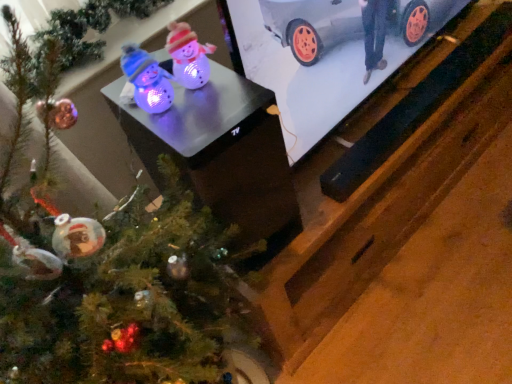
The image size is (512, 384). What are the coordinates of `green matte christmas tree at lower left` in the screenshot? It's located at (105, 272).

From the image's perspective, is matte plastic table at center on metallic silver car at upper right?

Actually, matte plastic table at center appears below metallic silver car at upper right in the image.

Is there a large distance between matte plastic table at center and metallic silver car at upper right?

matte plastic table at center is near metallic silver car at upper right, not far away.

Considering the relative sizes of matte plastic table at center and metallic silver car at upper right in the image provided, is matte plastic table at center taller than metallic silver car at upper right?

No.

From a real-world perspective, relative to metallic silver car at upper right, is matte plastic table at center vertically above or below?

matte plastic table at center is below metallic silver car at upper right.

From a real-world perspective, is green matte christmas tree at lower left above or below matte plastic table at center?

In terms of real-world spatial position, green matte christmas tree at lower left is below matte plastic table at center.

Is green matte christmas tree at lower left far from matte plastic table at center?

No, green matte christmas tree at lower left is not far from matte plastic table at center.

From the image's perspective, would you say green matte christmas tree at lower left is positioned over matte plastic table at center?

No.

Which is less distant, (211, 195) or (49, 57)?

Point (211, 195).

From the picture: Measure the distance between matte plastic table at center and green matte christmas tree at lower left.

A distance of 5.96 inches exists between matte plastic table at center and green matte christmas tree at lower left.

At what (x,y) coordinates should I click in order to perform the action: click on christmas tree below the matte plastic table at center (from the image's perspective). Please return your answer as a coordinate pair (x, y). This screenshot has height=384, width=512. Looking at the image, I should click on (105, 272).

Is matte plastic table at center outside of green matte christmas tree at lower left?

matte plastic table at center is positioned outside green matte christmas tree at lower left.

How much distance is there between green matte christmas tree at lower left and metallic silver car at upper right?

They are 18.28 inches apart.

Where is `tv show above the green matte christmas tree at lower left (from the image's perspective)`? The image size is (512, 384). tv show above the green matte christmas tree at lower left (from the image's perspective) is located at coordinates (325, 56).

Does green matte christmas tree at lower left have a lesser width compared to metallic silver car at upper right?

No.

Between green matte christmas tree at lower left and metallic silver car at upper right, which one has smaller size?

metallic silver car at upper right.

Is metallic silver car at upper right inside or outside of green matte christmas tree at lower left?

metallic silver car at upper right cannot be found inside green matte christmas tree at lower left.

Is metallic silver car at upper right behind green matte christmas tree at lower left?

Yes.

Is metallic silver car at upper right facing away from green matte christmas tree at lower left?

No, metallic silver car at upper right's orientation is not away from green matte christmas tree at lower left.

Does metallic silver car at upper right touch matte plastic table at center?

No, metallic silver car at upper right is not making contact with matte plastic table at center.

Is metallic silver car at upper right facing towards matte plastic table at center?

No, metallic silver car at upper right is not turned towards matte plastic table at center.

Identify the location of tv show on the right of matte plastic table at center. (325, 56).

From the image's perspective, which one is positioned higher, metallic silver car at upper right or matte plastic table at center?

metallic silver car at upper right appears higher in the image.

Find the location of a particular element. Image resolution: width=512 pixels, height=384 pixels. tv show located above the matte plastic table at center (from the image's perspective) is located at coordinates (325, 56).

Image resolution: width=512 pixels, height=384 pixels. What are the coordinates of `christmas tree that appears below the matte plastic table at center (from the image's perspective)` in the screenshot? It's located at (105, 272).

Consider the image. Based on their spatial positions, is matte plastic table at center or metallic silver car at upper right further from green matte christmas tree at lower left?

metallic silver car at upper right.

Considering their positions, is metallic silver car at upper right positioned further to matte plastic table at center than green matte christmas tree at lower left?

metallic silver car at upper right lies further to matte plastic table at center than the other object.

Based on their spatial positions, is metallic silver car at upper right or matte plastic table at center further from green matte christmas tree at lower left?

The object further to green matte christmas tree at lower left is metallic silver car at upper right.

Which object lies further to the anchor point metallic silver car at upper right, green matte christmas tree at lower left or matte plastic table at center?

Among the two, green matte christmas tree at lower left is located further to metallic silver car at upper right.

Looking at the image, which one is located closer to matte plastic table at center, green matte christmas tree at lower left or metallic silver car at upper right?

green matte christmas tree at lower left is positioned closer to the anchor matte plastic table at center.

When comparing their distances from metallic silver car at upper right, does matte plastic table at center or green matte christmas tree at lower left seem closer?

matte plastic table at center is closer to metallic silver car at upper right.

Find the location of a particular element. This screenshot has height=384, width=512. table between metallic silver car at upper right and green matte christmas tree at lower left in the vertical direction is located at coordinates (222, 155).